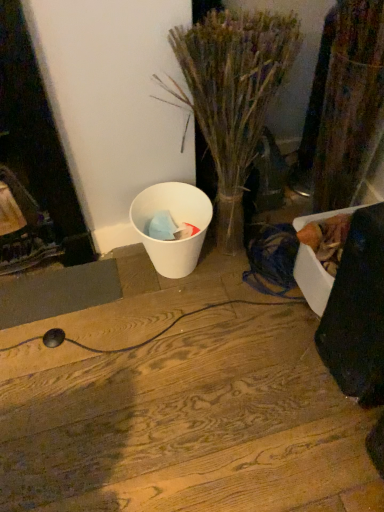
In order to face white matte trash can at lower left, should I rotate leftwards or rightwards?

Turn left approximately 2.965 degrees to face it.

This screenshot has width=384, height=512. Find the location of `white matte trash can at lower left`. white matte trash can at lower left is located at coordinates (176, 224).

Identify the location of wooden floor at center. (186, 422).

In terms of size, does translucent glass vase at center appear bigger or smaller than wooden floor at center?

In the image, translucent glass vase at center appears to be larger than wooden floor at center.

How many degrees apart are the facing directions of translucent glass vase at center and wooden floor at center?

translucent glass vase at center and wooden floor at center are facing 0.163 degrees away from each other.

Which is behind, point (173, 93) or point (66, 376)?

The point (66, 376) is farther.

Can you confirm if translucent glass vase at center is wider than wooden floor at center?

Incorrect, the width of translucent glass vase at center does not surpass that of wooden floor at center.

Can you tell me how much white matte trash can at lower left and translucent glass vase at center differ in facing direction?

0.229 degrees separate the facing orientations of white matte trash can at lower left and translucent glass vase at center.

Is translucent glass vase at center located within white matte trash can at lower left?

That's incorrect, translucent glass vase at center is not inside white matte trash can at lower left.

Considering the sizes of white matte trash can at lower left and translucent glass vase at center in the image, is white matte trash can at lower left bigger or smaller than translucent glass vase at center?

Considering their sizes, white matte trash can at lower left takes up less space than translucent glass vase at center.

Measure the distance between white matte trash can at lower left and translucent glass vase at center.

white matte trash can at lower left is 11.30 inches away from translucent glass vase at center.

Considering the sizes of objects white matte trash can at lower left and wooden floor at center in the image provided, who is taller, white matte trash can at lower left or wooden floor at center?

white matte trash can at lower left.

Considering the positions of objects white matte trash can at lower left and wooden floor at center in the image provided, who is more to the left, white matte trash can at lower left or wooden floor at center?

From the viewer's perspective, wooden floor at center appears more on the left side.

From the image's perspective, is white matte trash can at lower left on wooden floor at center?

Yes, from the image's perspective, white matte trash can at lower left is over wooden floor at center.

Is wooden floor at center positioned beyond the bounds of translucent glass vase at center?

wooden floor at center lies outside translucent glass vase at center's area.

Looking at this image, considering the relative sizes of wooden floor at center and translucent glass vase at center in the image provided, is wooden floor at center wider than translucent glass vase at center?

Yes, wooden floor at center is wider than translucent glass vase at center.

This screenshot has width=384, height=512. Find the location of `wood behind the translucent glass vase at center`. wood behind the translucent glass vase at center is located at coordinates (186, 422).

Is wooden floor at center shorter than translucent glass vase at center?

Indeed, wooden floor at center has a lesser height compared to translucent glass vase at center.

Is translucent glass vase at center inside or outside of white matte trash can at lower left?

translucent glass vase at center is not inside white matte trash can at lower left, it's outside.

From the image's perspective, between translucent glass vase at center and white matte trash can at lower left, who is located below?

white matte trash can at lower left appears lower in the image.

Is translucent glass vase at center oriented towards white matte trash can at lower left?

No, translucent glass vase at center is not oriented towards white matte trash can at lower left.

What's the angular difference between wooden floor at center and white matte trash can at lower left's facing directions?

There is a 0.0659-degree angle between the facing directions of wooden floor at center and white matte trash can at lower left.

Who is shorter, wooden floor at center or white matte trash can at lower left?

With less height is wooden floor at center.

What are the coordinates of `waste above the wooden floor at center (from the image's perspective)` in the screenshot? It's located at (176, 224).

Based on the photo, from a real-world perspective, which is physically above, wooden floor at center or white matte trash can at lower left?

white matte trash can at lower left, from a real-world perspective.

At what (x,y) coordinates should I click in order to perform the action: click on wood lying on the left of translucent glass vase at center. Please return your answer as a coordinate pair (x, y). This screenshot has height=512, width=384. Looking at the image, I should click on (186, 422).

The image size is (384, 512). What are the coordinates of `waste that is below the translucent glass vase at center (from the image's perspective)` in the screenshot? It's located at (176, 224).

When comparing their distances from white matte trash can at lower left, does translucent glass vase at center or wooden floor at center seem closer?

Based on the image, translucent glass vase at center appears to be nearer to white matte trash can at lower left.

Based on their spatial positions, is wooden floor at center or translucent glass vase at center closer to white matte trash can at lower left?

translucent glass vase at center is closer to white matte trash can at lower left.

Based on their spatial positions, is white matte trash can at lower left or wooden floor at center closer to translucent glass vase at center?

Based on the image, white matte trash can at lower left appears to be nearer to translucent glass vase at center.

Based on their spatial positions, is white matte trash can at lower left or translucent glass vase at center further from wooden floor at center?

translucent glass vase at center is further to wooden floor at center.

From the picture: Considering their positions, is wooden floor at center positioned closer to translucent glass vase at center than white matte trash can at lower left?

Based on the image, white matte trash can at lower left appears to be nearer to translucent glass vase at center.

Based on the photo, estimate the real-world distances between objects in this image. Which object is further from wooden floor at center, translucent glass vase at center or white matte trash can at lower left?

translucent glass vase at center lies further to wooden floor at center than the other object.

The image size is (384, 512). I want to click on waste between translucent glass vase at center and wooden floor at center from top to bottom, so click(x=176, y=224).